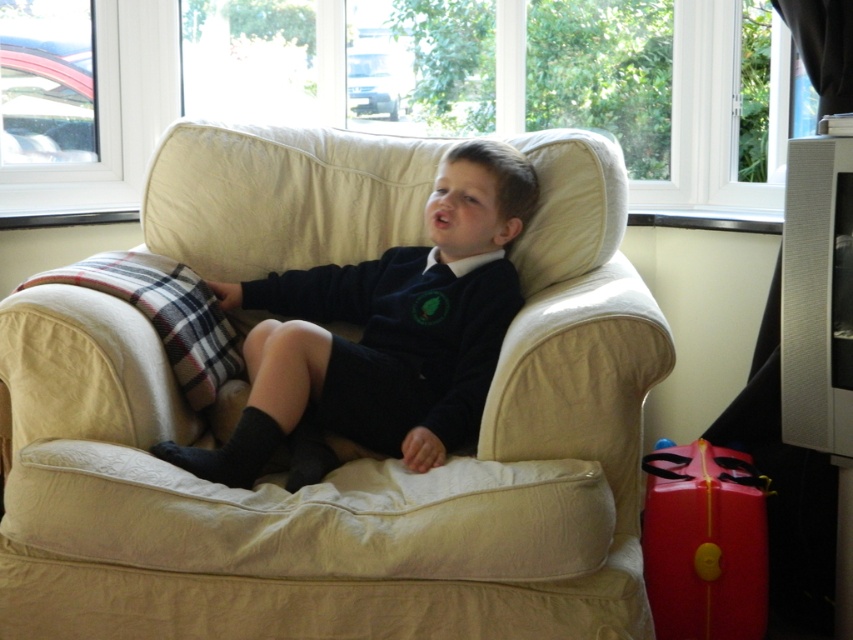
Can you confirm if beige fabric armchair at center is shorter than dark blue jersey at center?

Incorrect, beige fabric armchair at center's height does not fall short of dark blue jersey at center's.

Is point (349, 198) behind point (474, 326)?

Yes, point (349, 198) is behind point (474, 326).

Find the location of `beige fabric armchair at center`. beige fabric armchair at center is located at coordinates (347, 468).

Does dark blue jersey at center have a lesser height compared to rubberized red suitcase at lower right?

No.

Between point (424, 280) and point (726, 573), which one is positioned in front?

Point (726, 573) is in front.

Find the location of `dark blue jersey at center`. dark blue jersey at center is located at coordinates (403, 339).

Who is positioned more to the left, matte black sweater at center or rubberized red suitcase at lower right?

Positioned to the left is matte black sweater at center.

Find the location of `matte black sweater at center`. matte black sweater at center is located at coordinates (381, 337).